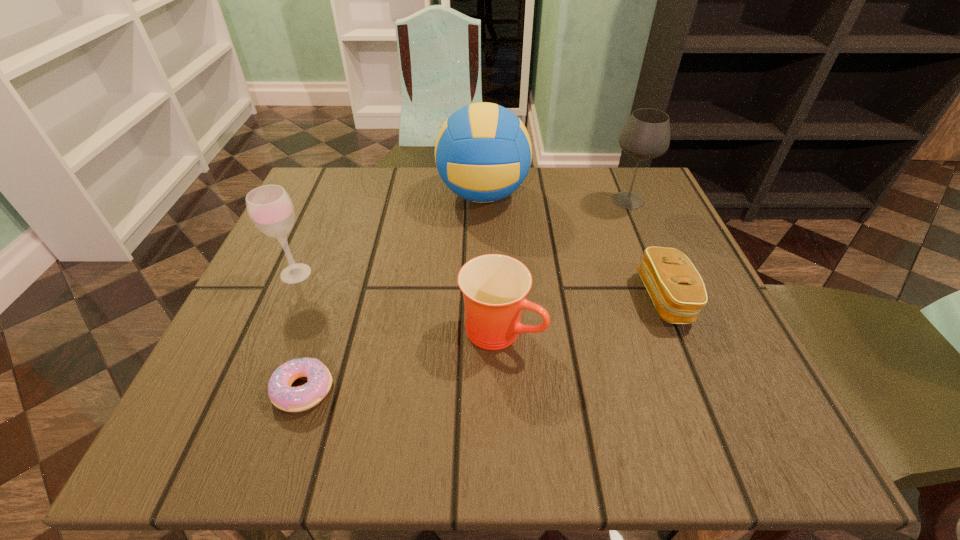
At what (x,y) coordinates should I click in order to perform the action: click on free point at the near left corner. Please return your answer as a coordinate pair (x, y). Looking at the image, I should click on (197, 433).

You are a GUI agent. You are given a task and a screenshot of the screen. Output one action in this format:
    pyautogui.click(x=<x>, y=<y>)
    Task: Click on the vacant space at the near right corner of the desktop
    
    Given the screenshot: What is the action you would take?
    pyautogui.click(x=741, y=423)

I want to click on vacant space in between the third shortest object and the right wineglass, so click(564, 265).

Locate an element on the screen. vacant area that lies between the fifth object from right to left and the nearer wineglass is located at coordinates (300, 331).

I want to click on unoccupied area between the second shortest object and the third shortest object, so click(x=584, y=314).

The width and height of the screenshot is (960, 540). Find the location of `free spot between the fifth object from right to left and the volleyball`. free spot between the fifth object from right to left and the volleyball is located at coordinates (394, 292).

Identify the location of free space between the cup and the nearest object. (402, 360).

This screenshot has height=540, width=960. Identify the location of free space between the third shortest object and the right wineglass. (564, 265).

Image resolution: width=960 pixels, height=540 pixels. Identify the location of vacant area that lies between the left wineglass and the farther wineglass. (462, 237).

Image resolution: width=960 pixels, height=540 pixels. In order to click on object identified as the third closest to the left wineglass in this screenshot , I will do `click(494, 286)`.